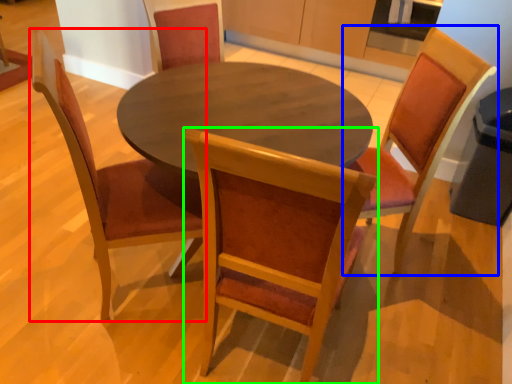
Question: Which object is the closest to the chair (highlighted by a red box)? Choose among these: chair (highlighted by a blue box) or chair (highlighted by a green box).

Choices:
 (A) chair
 (B) chair

Answer: (B)